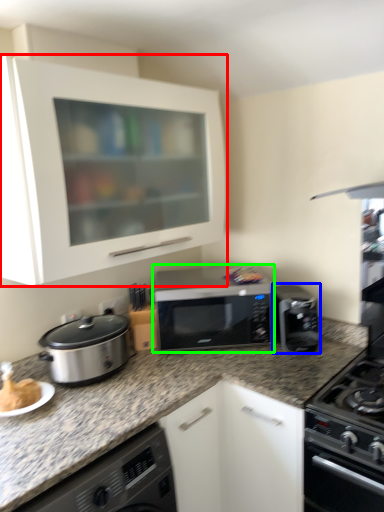
Question: Estimate the real-world distances between objects in this image. Which object is closer to cabinetry (highlighted by a red box), kitchen appliance (highlighted by a blue box) or microwave oven (highlighted by a green box)?

Choices:
 (A) kitchen appliance
 (B) microwave oven

Answer: (B)